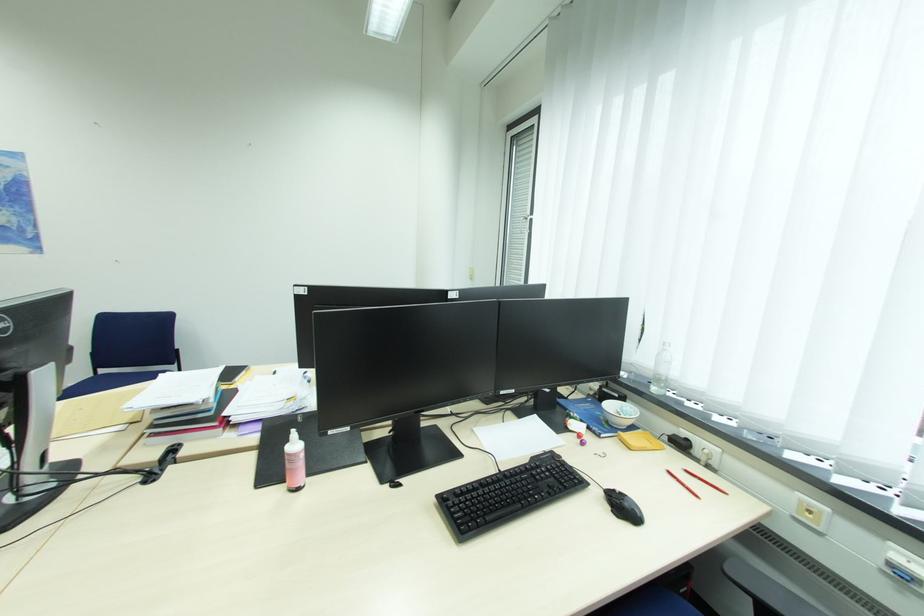
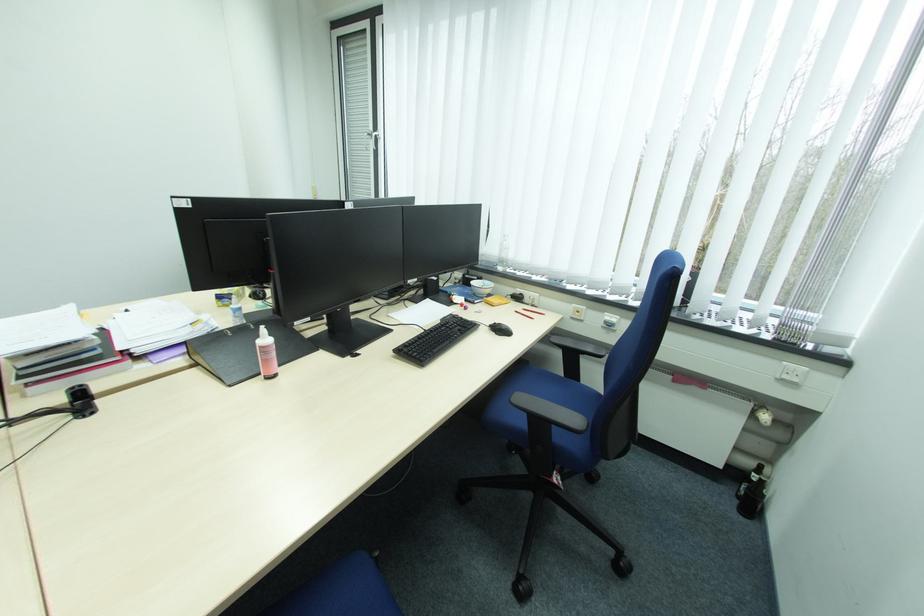
Question: The camera is either moving clockwise (left) or counter-clockwise (right) around the object. The first image is from the beginning of the video and the second image is from the end. Is the camera moving left or right when shooting the video?

Choices:
 (A) Left
 (B) Right

Answer: (A)